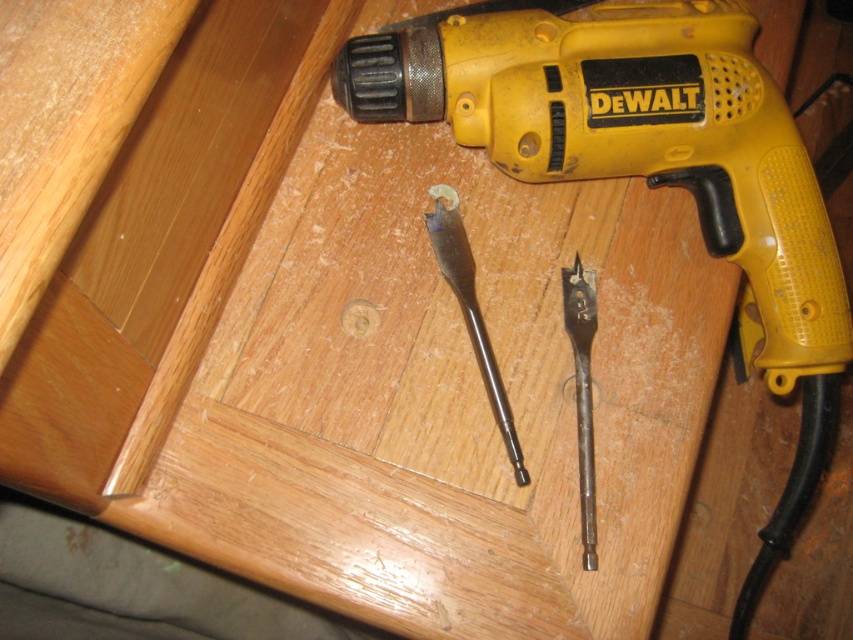
Is point (366, 97) more distant than point (456, 209)?

No, (366, 97) is in front of (456, 209).

Which of these two, yellow plastic drill at upper right or matte metal drill bit at center, stands taller?

yellow plastic drill at upper right

Locate an element on the screen. The width and height of the screenshot is (853, 640). yellow plastic drill at upper right is located at coordinates (647, 177).

The width and height of the screenshot is (853, 640). Identify the location of yellow plastic drill at upper right. (647, 177).

Identify the location of yellow plastic drill at upper right. The width and height of the screenshot is (853, 640). (647, 177).

Where is `yellow plastic drill at upper right`? yellow plastic drill at upper right is located at coordinates (647, 177).

I want to click on yellow plastic drill at upper right, so click(647, 177).

Who is positioned more to the right, matte metal drill bit at center or black metal drill bit at center?

black metal drill bit at center

This screenshot has height=640, width=853. What do you see at coordinates (469, 310) in the screenshot?
I see `matte metal drill bit at center` at bounding box center [469, 310].

At what (x,y) coordinates should I click in order to perform the action: click on matte metal drill bit at center. Please return your answer as a coordinate pair (x, y). The image size is (853, 640). Looking at the image, I should click on (469, 310).